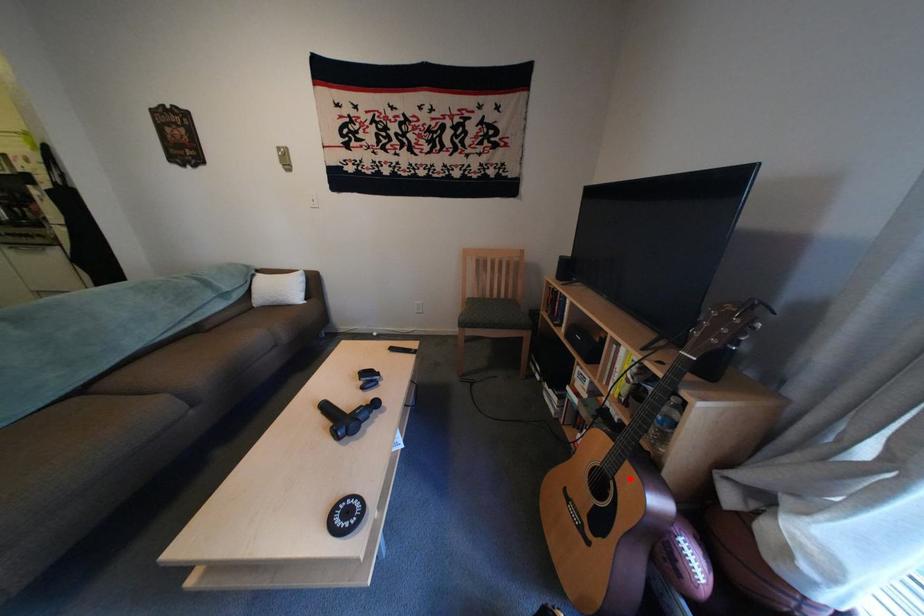
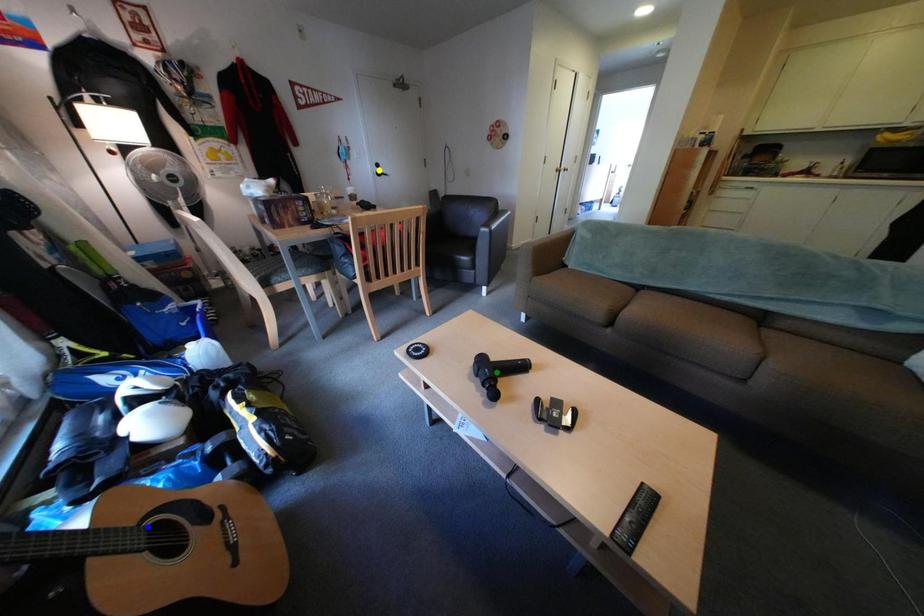
Question: I am providing you with two images of the same scene from different viewpoints. A red point is marked on the first image. You are given multiple points on the second image. Which mark in image 2 goes with the point in image 1?

Choices:
 (A) yellow point
 (B) blue point
 (C) green point

Answer: (B)